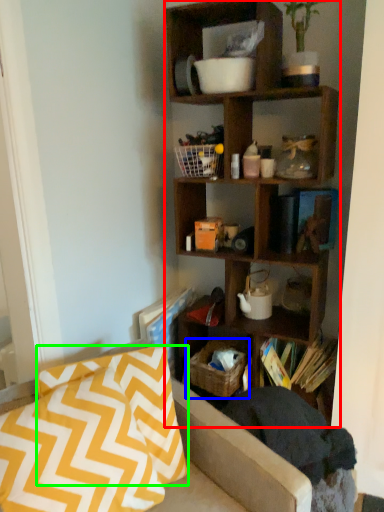
Question: Which object is positioned farthest from shelf (highlighted by a red box)? Select from crate (highlighted by a blue box) and pillow (highlighted by a green box).

Choices:
 (A) crate
 (B) pillow

Answer: (B)